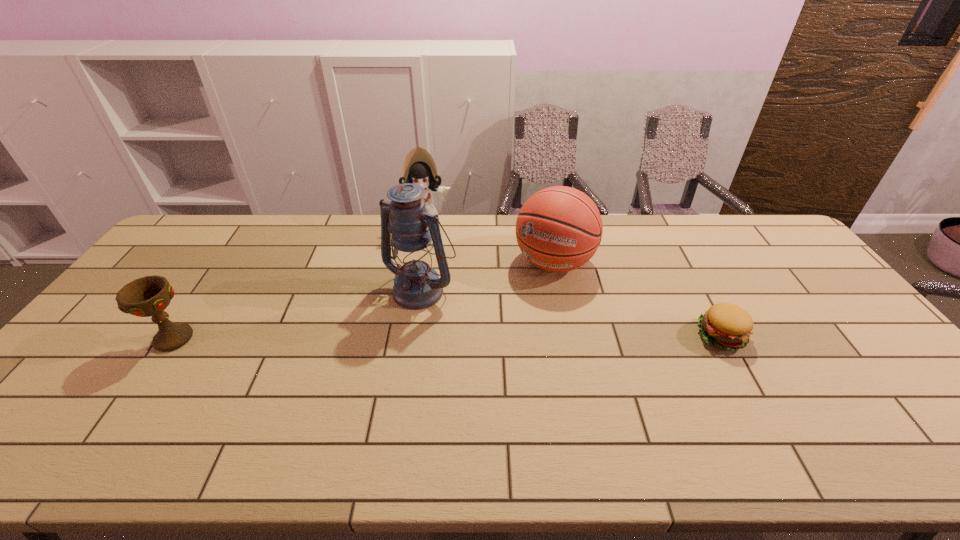
The width and height of the screenshot is (960, 540). Find the location of `free spot at the far edge of the desktop`. free spot at the far edge of the desktop is located at coordinates (235, 242).

Identify the location of vacant space at the near edge. This screenshot has height=540, width=960. (788, 404).

This screenshot has height=540, width=960. Identify the location of vacant region at the right edge of the desktop. (788, 267).

Where is `free space at the near left corner of the desktop`? Image resolution: width=960 pixels, height=540 pixels. free space at the near left corner of the desktop is located at coordinates (68, 393).

What are the coordinates of `vacant area between the chalice and the farthest object` in the screenshot? It's located at (300, 282).

Find the location of a particular element. The width and height of the screenshot is (960, 540). free point between the hamburger and the tallest object is located at coordinates (571, 312).

Where is `vacant space that's between the tallest object and the basketball`? The image size is (960, 540). vacant space that's between the tallest object and the basketball is located at coordinates (488, 275).

At what (x,y) coordinates should I click in order to perform the action: click on free point between the farthest object and the leftmost object. Please return your answer as a coordinate pair (x, y). The width and height of the screenshot is (960, 540). Looking at the image, I should click on (300, 282).

Locate an element on the screen. This screenshot has width=960, height=540. empty space that is in between the shortest object and the farthest object is located at coordinates (573, 281).

Find the location of a particular element. vacant region between the lantern and the fourth object from left to right is located at coordinates (488, 275).